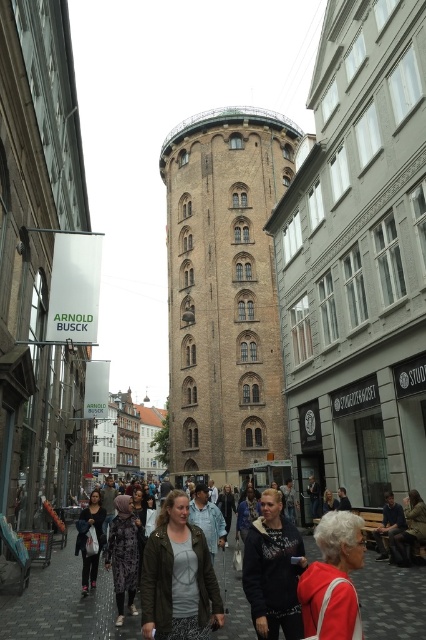
Is green textured jacket at center smaller than dark gray fabric jacket at lower center?

Indeed, green textured jacket at center has a smaller size compared to dark gray fabric jacket at lower center.

From the picture: Does green textured jacket at center have a greater height compared to dark gray fabric jacket at lower center?

No.

Which is in front, point (198, 636) or point (100, 531)?

Point (198, 636) is more forward.

You are a GUI agent. You are given a task and a screenshot of the screen. Output one action in this format:
    pyautogui.click(x=<x>, y=<y>)
    Task: Click on the green textured jacket at center
    This screenshot has width=426, height=640.
    Given the screenshot: What is the action you would take?
    pyautogui.click(x=178, y=577)

Is brown brick tower at center positioned behind matte red jacket at lower right?

Yes.

Who is positioned more to the right, brown brick tower at center or matte red jacket at lower right?

From the viewer's perspective, matte red jacket at lower right appears more on the right side.

Locate an element on the screen. The width and height of the screenshot is (426, 640). brown brick tower at center is located at coordinates (224, 291).

Identify the location of green textured jacket at center. (178, 577).

Which is behind, point (149, 554) or point (357, 566)?

Positioned behind is point (149, 554).

You are a GUI agent. You are given a task and a screenshot of the screen. Output one action in this format:
    pyautogui.click(x=<x>, y=<y>)
    Task: Click on the green textured jacket at center
    
    Given the screenshot: What is the action you would take?
    pyautogui.click(x=178, y=577)